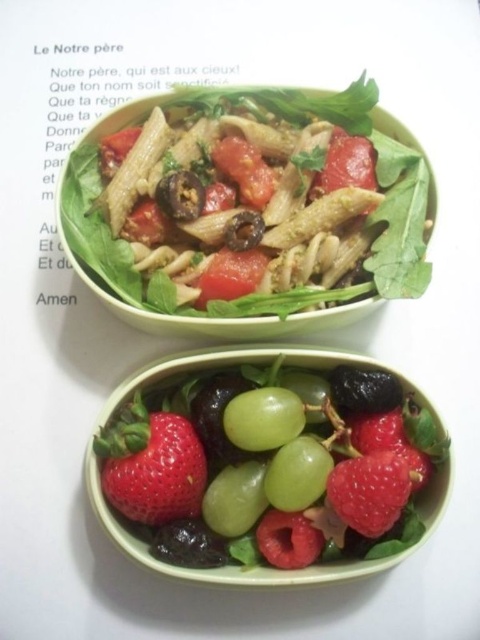
Question: Is green matte pasta salad at upper center bigger than green matte grape at center?

Choices:
 (A) yes
 (B) no

Answer: (A)

Question: Which is nearer to the red matte strawberry at lower right?

Choices:
 (A) green matte grape at center
 (B) red matte strawberry at center

Answer: (A)

Question: Is green matte grape at center bigger than red matte strawberry at lower right?

Choices:
 (A) yes
 (B) no

Answer: (A)

Question: Among these points, which one is farthest from the camera?

Choices:
 (A) (143, 451)
 (B) (288, 390)

Answer: (B)

Question: Can you confirm if green matte grape at center is smaller than red matte strawberry at center?

Choices:
 (A) yes
 (B) no

Answer: (B)

Question: Which point appears farthest from the camera in this image?

Choices:
 (A) (348, 513)
 (B) (180, 419)
 (C) (373, 104)
 (D) (240, 467)

Answer: (C)